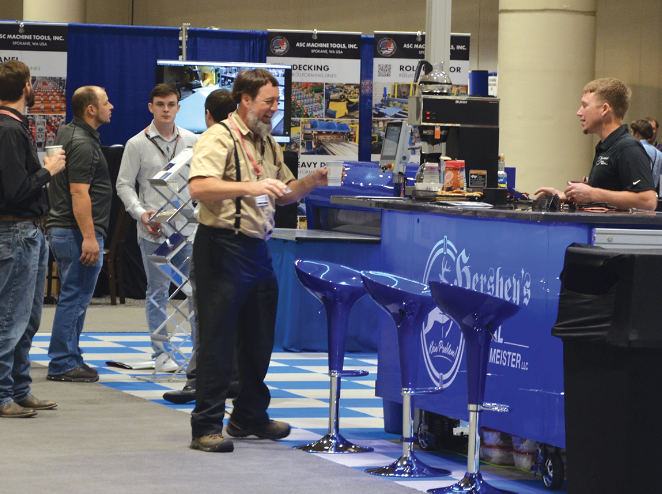
Where is `floor`? This screenshot has width=662, height=494. floor is located at coordinates (116, 446), (173, 459), (163, 468), (46, 470).